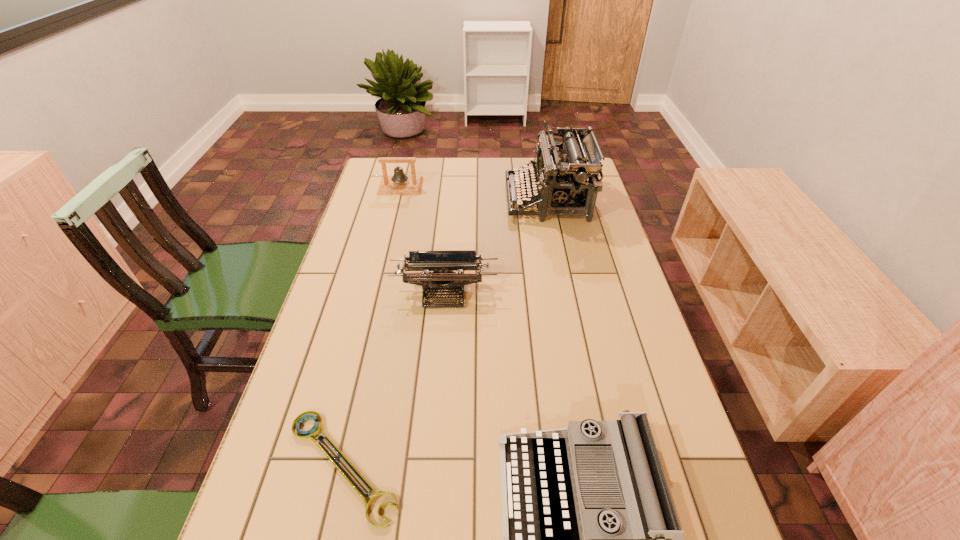
Where is `the tallest typewriter`? This screenshot has width=960, height=540. the tallest typewriter is located at coordinates (563, 181).

Image resolution: width=960 pixels, height=540 pixels. Find the location of `the farthest typewriter`. the farthest typewriter is located at coordinates (563, 181).

This screenshot has height=540, width=960. I want to click on bell, so click(x=398, y=184).

Where is `the third farthest object`? the third farthest object is located at coordinates (442, 263).

The width and height of the screenshot is (960, 540). I want to click on the shortest object, so click(309, 435).

Identify the location of vacant space located on the typing side of the tallest object. Image resolution: width=960 pixels, height=540 pixels. click(438, 199).

At what (x,y) coordinates should I click in order to perform the action: click on free space located on the typing side of the tallest object. Please return your answer as a coordinate pair (x, y). This screenshot has width=960, height=540. Looking at the image, I should click on (399, 199).

At what (x,y) coordinates should I click in order to perform the action: click on vacant area located 0.190m on the typing side of the tallest object. Please return your answer as a coordinate pair (x, y). The width and height of the screenshot is (960, 540). Looking at the image, I should click on (454, 199).

This screenshot has width=960, height=540. What are the coordinates of `vacant space located on the front of the bell` in the screenshot? It's located at (387, 244).

The height and width of the screenshot is (540, 960). I want to click on vacant space located on the typing side of the second farthest typewriter, so click(x=437, y=381).